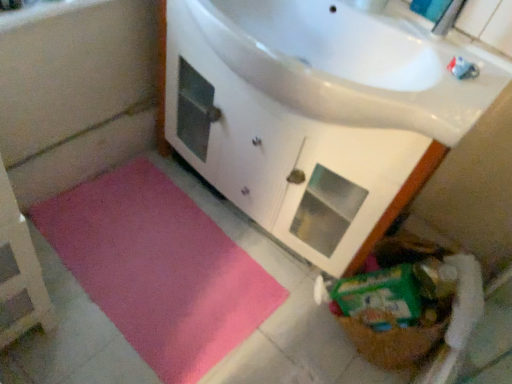
Identify the location of free space that is in between white glossy cabinet at upper center and pink plush bath mat at lower left. (269, 312).